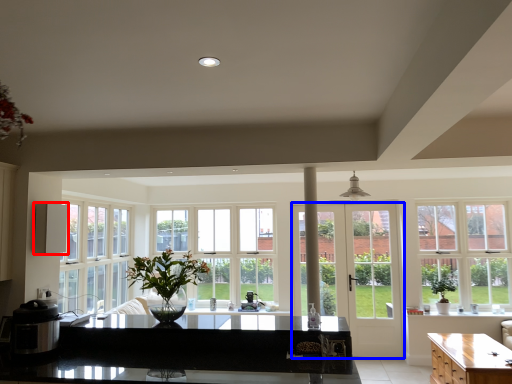
Question: Which of the following is the closest to the observer, appliance (highlighted by a red box) or door (highlighted by a blue box)?

Choices:
 (A) appliance
 (B) door

Answer: (A)